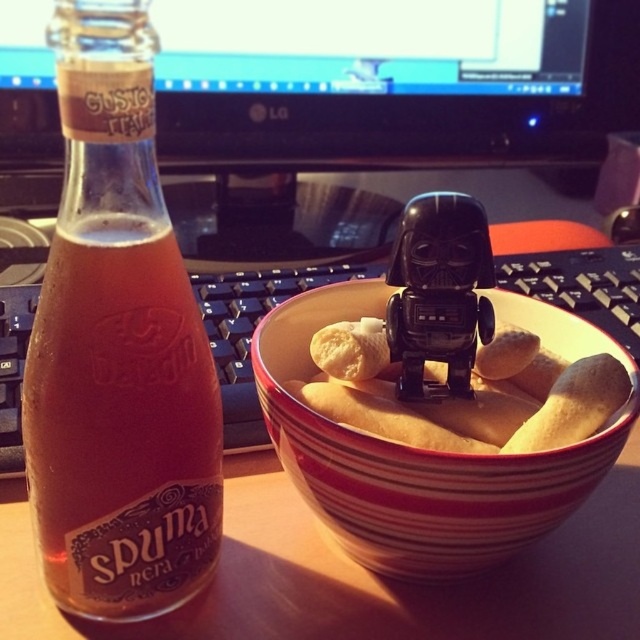
Is translucent glass bottle at left above black plastic toy at center?

No, translucent glass bottle at left is not above black plastic toy at center.

Is translucent glass bottle at left wider than black plastic toy at center?

Yes, translucent glass bottle at left is wider than black plastic toy at center.

Measure the distance between point (147, 189) and camera.

Point (147, 189) and camera are 10.63 inches apart.

Where is `translucent glass bottle at left`? translucent glass bottle at left is located at coordinates pyautogui.click(x=116, y=348).

Does translucent glass bottle at left have a larger size compared to striped ceramic bowl at center?

Incorrect, translucent glass bottle at left is not larger than striped ceramic bowl at center.

Does point (83, 388) come behind point (554, 490)?

No, (83, 388) is in front of (554, 490).

At what (x,y) coordinates should I click in order to perform the action: click on translucent glass bottle at left. Please return your answer as a coordinate pair (x, y). Looking at the image, I should click on (116, 348).

Can you confirm if yellow matte bread at center is wider than black plastic toy at center?

Yes, yellow matte bread at center is wider than black plastic toy at center.

Who is taller, yellow matte bread at center or black plastic toy at center?

With more height is black plastic toy at center.

Does point (500, 346) come in front of point (428, 248)?

No.

You are a GUI agent. You are given a task and a screenshot of the screen. Output one action in this format:
    pyautogui.click(x=<x>, y=<y>)
    Task: Click on the yellow matte bread at center
    Image resolution: width=640 pixels, height=640 pixels.
    Given the screenshot: What is the action you would take?
    pyautogui.click(x=460, y=397)